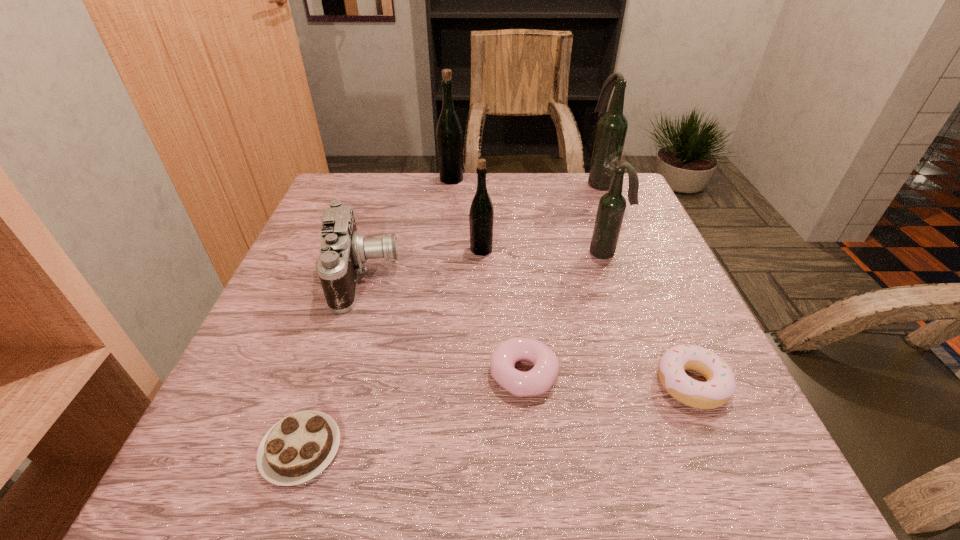
Identify the location of free space between the nearer dark beer bottle and the farther green beer bottle. The image size is (960, 540). (529, 216).

The width and height of the screenshot is (960, 540). Find the location of `object that can be found as the second closest to the right green beer bottle`. object that can be found as the second closest to the right green beer bottle is located at coordinates (611, 208).

Identify which object is the second closest to the white doughnut. Please provide its 2D coordinates. Your answer should be formatted as a tuple, i.e. [(x, y)], where the tuple contains the x and y coordinates of a point satisfying the conditions above.

[(611, 208)]

This screenshot has width=960, height=540. I want to click on beer bottle that stands as the fourth closest to the white doughnut, so click(449, 135).

Find the location of a particular element. This screenshot has width=960, height=540. the fourth closest beer bottle relative to the chocolate cake is located at coordinates (612, 127).

At what (x,y) coordinates should I click in order to perform the action: click on vacant space that satisfies the following two spatial constraints: 1. on the back side of the nearest object; 2. on the right side of the leftmost beer bottle. Please return your answer as a coordinate pair (x, y). The image size is (960, 540). Looking at the image, I should click on (388, 179).

The image size is (960, 540). In order to click on free spot that satisfies the following two spatial constraints: 1. on the front side of the third beer bottle from right to left; 2. at the lens of the camera in this screenshot , I will do `click(482, 275)`.